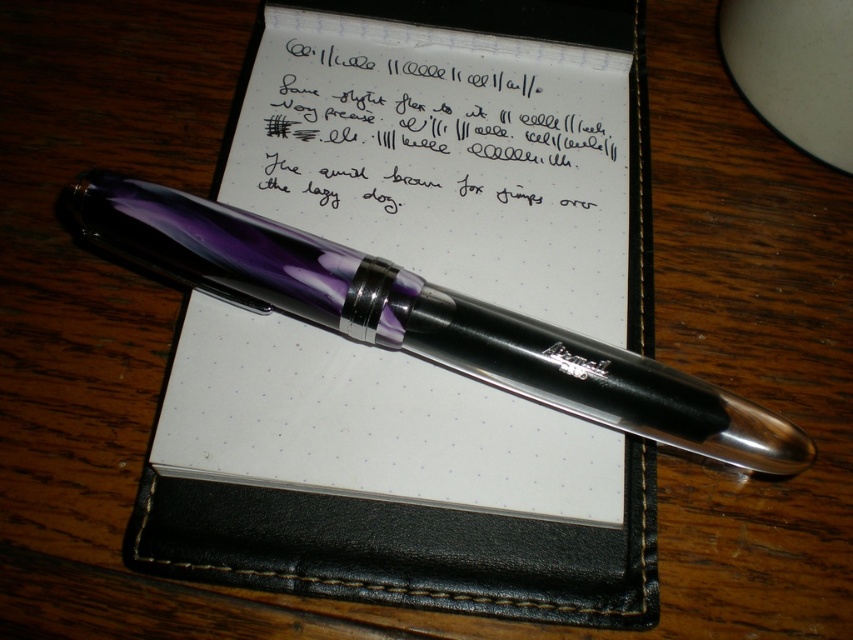
Does black leather notebook at center have a lesser height compared to black paper at center?

No.

Is black leather notebook at center below black paper at center?

Yes.

Does point (579, 464) come farther from viewer compared to point (573, 81)?

No.

Locate an element on the screen. The height and width of the screenshot is (640, 853). black leather notebook at center is located at coordinates (386, 481).

Does point (491, 16) come in front of point (753, 442)?

That is False.

Does black leather notebook at center have a smaller size compared to translucent purple pen at center?

No.

Is point (198, 518) positioned after point (589, 417)?

No, it is in front of (589, 417).

You are a GUI agent. You are given a task and a screenshot of the screen. Output one action in this format:
    pyautogui.click(x=<x>, y=<y>)
    Task: Click on the black leather notebook at center
    Image resolution: width=853 pixels, height=640 pixels.
    Given the screenshot: What is the action you would take?
    386,481

Does black paper at center appear on the left side of translucent purple pen at center?

Correct, you'll find black paper at center to the left of translucent purple pen at center.

Between point (341, 204) and point (241, 220), which one is positioned behind?

The point (341, 204) is behind.

Is point (479, 168) positioned after point (782, 465)?

Yes, it is behind point (782, 465).

I want to click on black paper at center, so click(432, 134).